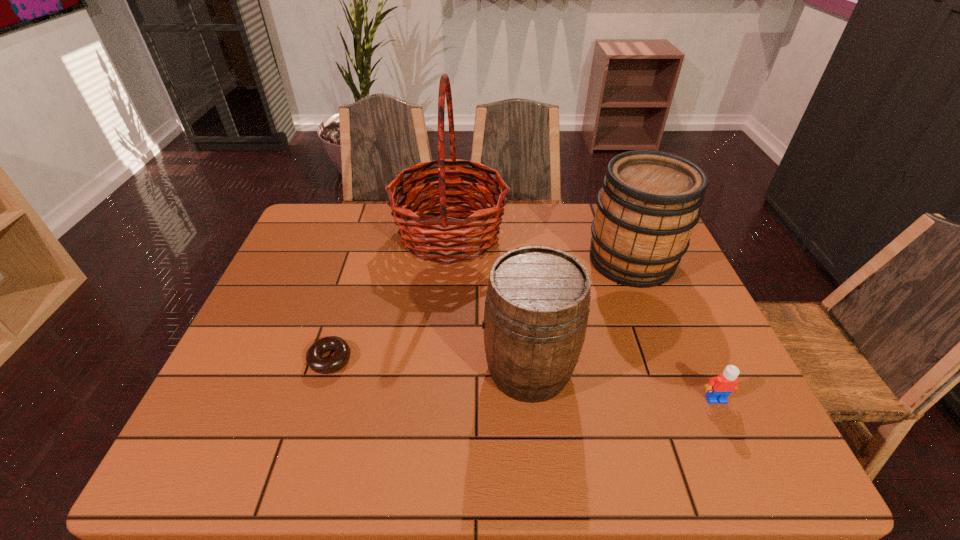
The width and height of the screenshot is (960, 540). Identify the location of object that can be found as the fourth closest to the tallest object. (718, 389).

Find the location of a particular element. The width and height of the screenshot is (960, 540). object that is the closest to the doughnut is located at coordinates (445, 244).

The width and height of the screenshot is (960, 540). I want to click on free space that satisfies the following two spatial constraints: 1. on the back side of the right cider; 2. on the handle side of the basket, so click(x=621, y=234).

Image resolution: width=960 pixels, height=540 pixels. What are the coordinates of `free spot that satisfies the following two spatial constraints: 1. on the handle side of the tallest object; 2. on the front side of the leftmost object` in the screenshot? It's located at (440, 360).

Locate an element on the screen. This screenshot has height=540, width=960. vacant region that satisfies the following two spatial constraints: 1. on the front side of the right cider; 2. on the side of the left cider near the bung hole is located at coordinates (675, 369).